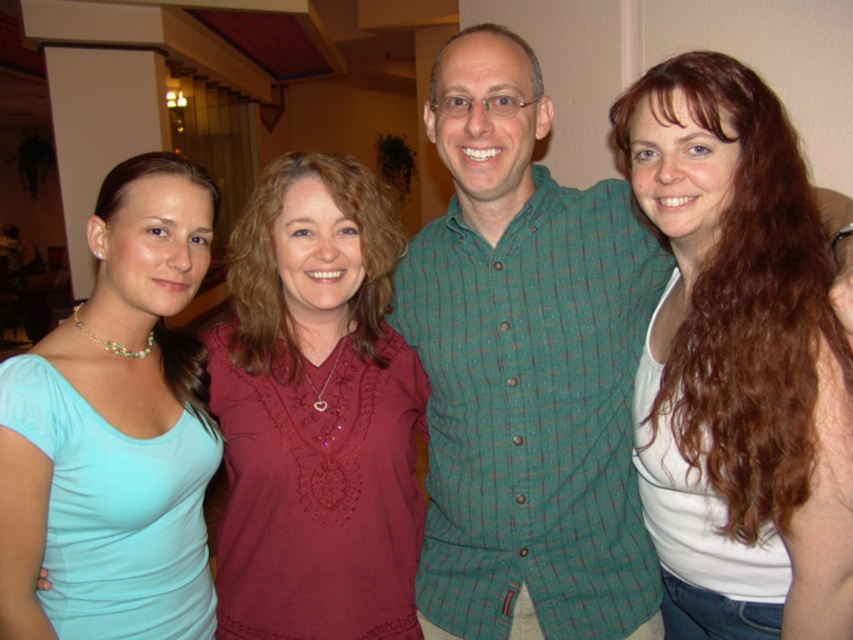
Who is higher up, green checkered shirt at center or light blue fabric shirt at left?

Positioned higher is green checkered shirt at center.

How far apart are green checkered shirt at center and light blue fabric shirt at left?

green checkered shirt at center and light blue fabric shirt at left are 20.16 inches apart.

Find the location of `green checkered shirt at center`. green checkered shirt at center is located at coordinates (525, 369).

Does green checkered shirt at center have a larger size compared to matte red blouse at center?

No, green checkered shirt at center is not bigger than matte red blouse at center.

The width and height of the screenshot is (853, 640). What do you see at coordinates (525, 369) in the screenshot?
I see `green checkered shirt at center` at bounding box center [525, 369].

Locate an element on the screen. The width and height of the screenshot is (853, 640). green checkered shirt at center is located at coordinates (525, 369).

Which is behind, point (747, 141) or point (157, 224)?

Positioned behind is point (157, 224).

Between white matte tank top at right and light blue fabric shirt at left, which one is positioned lower?

Positioned lower is light blue fabric shirt at left.

Measure the distance between white matte tank top at right and camera.

white matte tank top at right is 3.49 feet from camera.

At what (x,y) coordinates should I click in order to perform the action: click on white matte tank top at right. Please return your answer as a coordinate pair (x, y). Looking at the image, I should click on (740, 360).